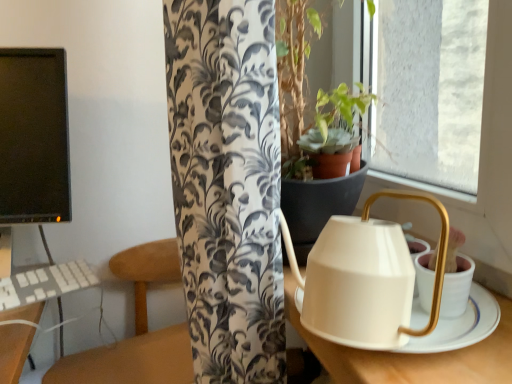
Question: Is wooden table at center taller or shorter than black matte monitor at left?

Choices:
 (A) tall
 (B) short

Answer: (B)

Question: In terms of width, does wooden table at center look wider or thinner when compared to black matte monitor at left?

Choices:
 (A) thin
 (B) wide

Answer: (B)

Question: Estimate the real-world distances between objects in this image. Which object is closer to the white plastic keyboard at lower left?

Choices:
 (A) black matte monitor at left
 (B) white matte kettle at right
 (C) wooden table at center

Answer: (A)

Question: Which of these objects is positioned farthest from the wooden table at center?

Choices:
 (A) white matte kettle at right
 (B) black matte monitor at left
 (C) white plastic keyboard at lower left

Answer: (A)